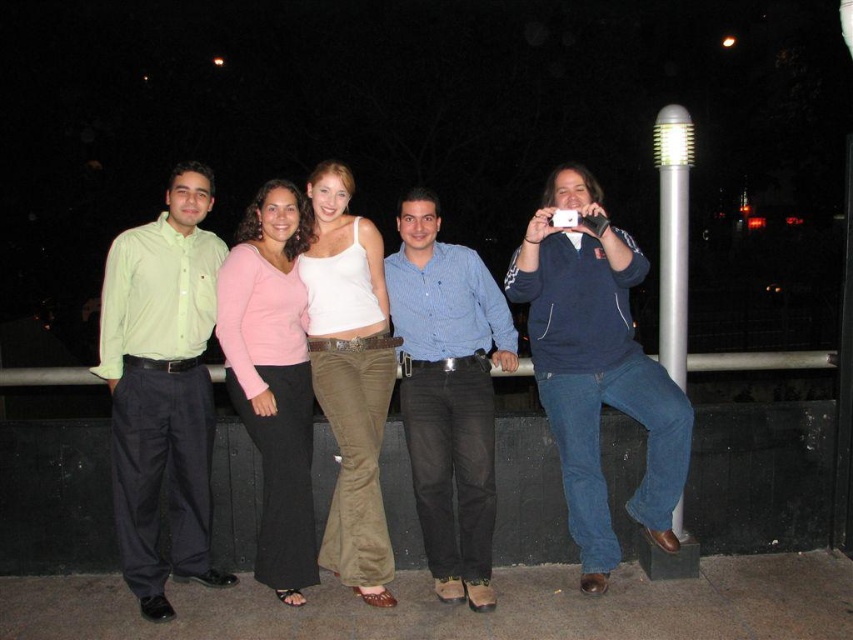
Question: Does white cotton tank top at center appear on the right side of silver metallic pole at right?

Choices:
 (A) yes
 (B) no

Answer: (B)

Question: Is blue cotton hoodie at right to the left of silver metallic pole at right from the viewer's perspective?

Choices:
 (A) yes
 (B) no

Answer: (A)

Question: Is light green shirt at left thinner than silver metallic pole at right?

Choices:
 (A) no
 (B) yes

Answer: (A)

Question: Considering the real-world distances, which object is closest to the silver metallic pole at right?

Choices:
 (A) blue checkered shirt at center
 (B) white cotton tank top at center

Answer: (A)

Question: Based on their relative distances, which object is nearer to the pink sweater at center?

Choices:
 (A) white cotton tank top at center
 (B) blue checkered shirt at center
 (C) blue cotton hoodie at right
 (D) silver metallic pole at right

Answer: (A)

Question: Which point is closer to the camera?

Choices:
 (A) (430, 392)
 (B) (306, 548)
 (C) (367, 326)

Answer: (B)